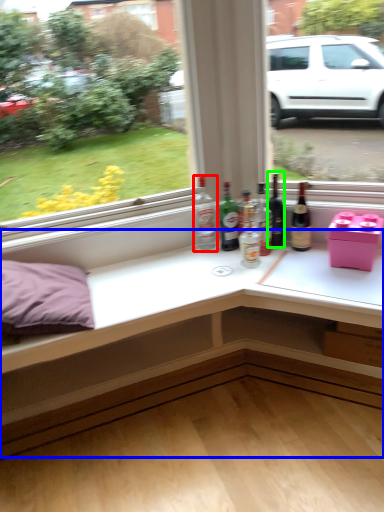
Question: Estimate the real-world distances between objects in this image. Which object is closer to bottle (highlighted by a red box), table (highlighted by a blue box) or beer bottle (highlighted by a green box)?

Choices:
 (A) table
 (B) beer bottle

Answer: (B)